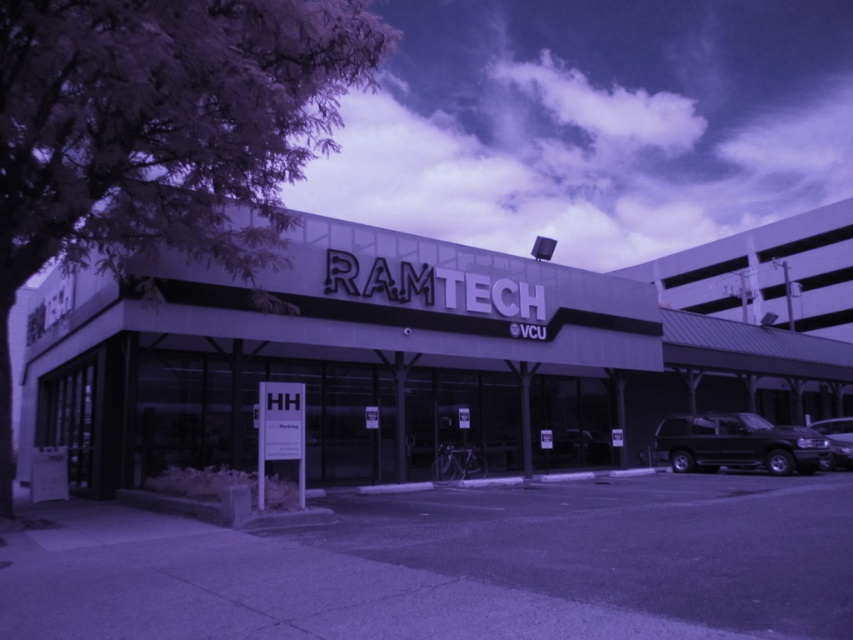
You are standing in front of the RAMTECH building and want to take a photo that includes both the entrance and the bicycle. The entrance is at point (x=769, y=436) and the bicycle is at point (x=830, y=435). Which point should you focus on first to ensure both are in frame?

You should focus on point (x=769, y=436) first because it is closer to the camera than point (x=830, y=435), ensuring both the entrance and bicycle are captured in the photo.

You are standing at the entrance of the RAMTECH building and want to walk to a specific location. There are two points marked on the ground in front of you at coordinates point (750, 237) and point (785, 426). Which point should you walk to first if you want to reach the one that is closer to the building?

You should walk to point (785, 426) first because it is closer to the building compared to point (750, 237), which is behind it.